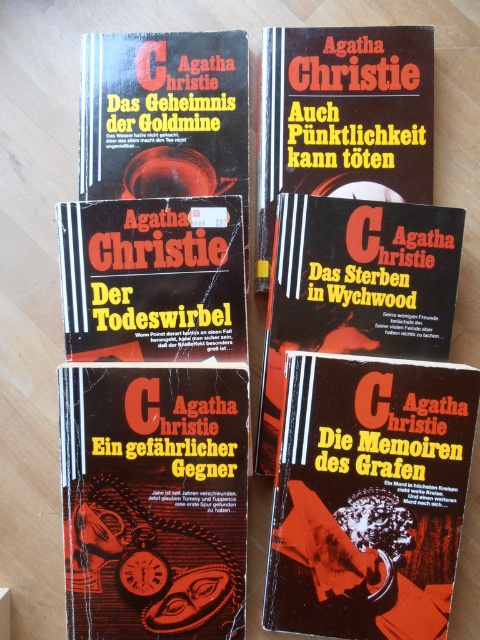
Who is lower down, matte black book cover at upper center or matte black book cover at center?

matte black book cover at center is lower down.

Can you confirm if matte black book cover at upper center is bigger than matte black book cover at center?

Correct, matte black book cover at upper center is larger in size than matte black book cover at center.

Is point (367, 76) farther from camera compared to point (156, 268)?

No, it is not.

The width and height of the screenshot is (480, 640). In order to click on matte black book cover at upper center in this screenshot , I will do `click(343, 118)`.

Is point (300, 240) closer to camera compared to point (91, 298)?

No.

In order to click on black matte book cover at center in this screenshot , I will do `click(356, 288)`.

Is point (323, 312) closer to viewer compared to point (104, 243)?

No, (323, 312) is behind (104, 243).

You are a GUI agent. You are given a task and a screenshot of the screen. Output one action in this format:
    pyautogui.click(x=<x>, y=<y>)
    Task: Click on the black matte book cover at center
    
    Given the screenshot: What is the action you would take?
    356,288

Which is below, matte black clock at center or matte black book cover at center?

Positioned lower is matte black clock at center.

From the picture: Who is higher up, matte black clock at center or matte black book cover at center?

matte black book cover at center is above.

This screenshot has width=480, height=640. I want to click on matte black clock at center, so click(x=154, y=500).